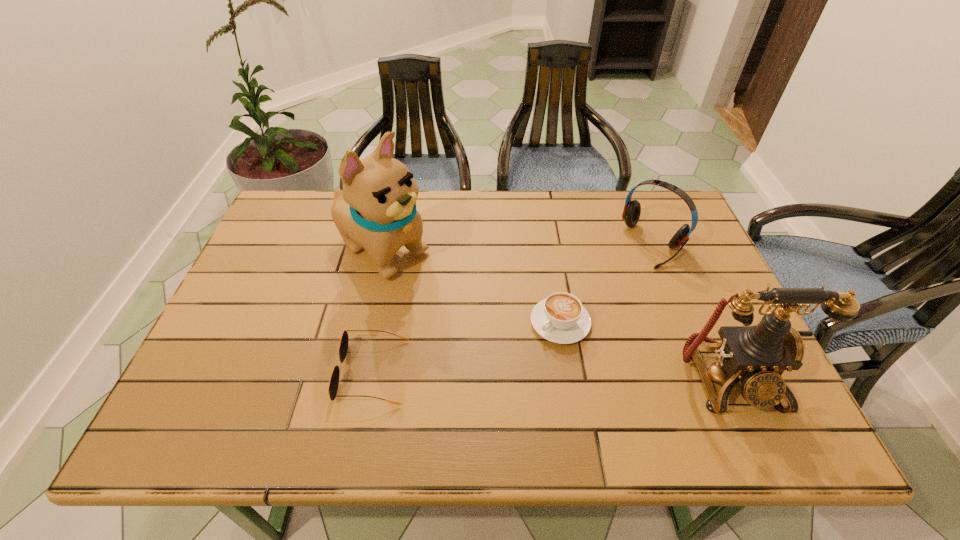
Identify the location of blank space that satisfies the following two spatial constraints: 1. on the front side of the third object from right to left; 2. on the right side of the puppy. (366, 323).

You are a GUI agent. You are given a task and a screenshot of the screen. Output one action in this format:
    pyautogui.click(x=<x>, y=<y>)
    Task: Click on the vacant space that satisfies the following two spatial constraints: 1. on the front side of the puppy; 2. on the front-facing side of the sunglasses
    The width and height of the screenshot is (960, 540).
    Given the screenshot: What is the action you would take?
    pyautogui.click(x=355, y=372)